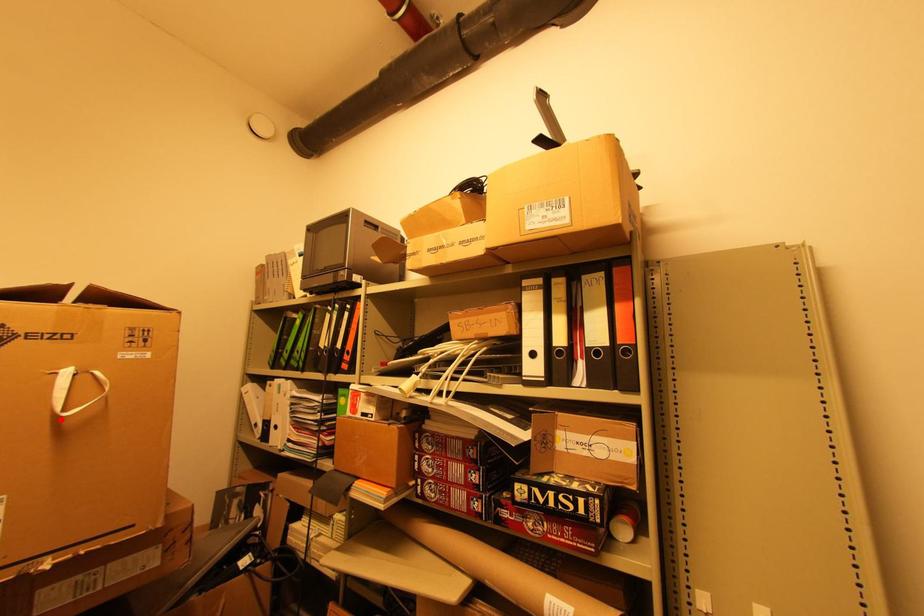
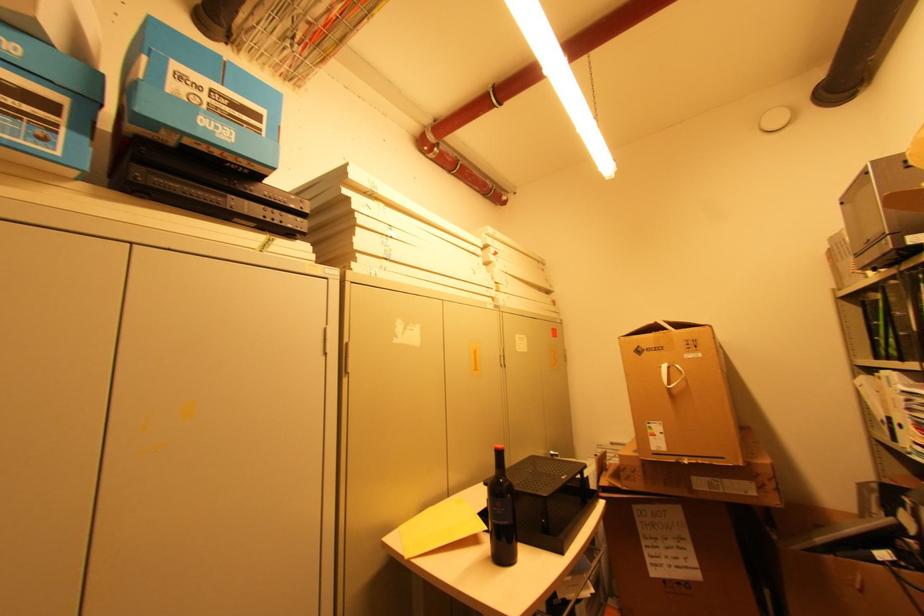
Where in the second image is the point corresponding to the highlighted location from the first image?

(672, 390)